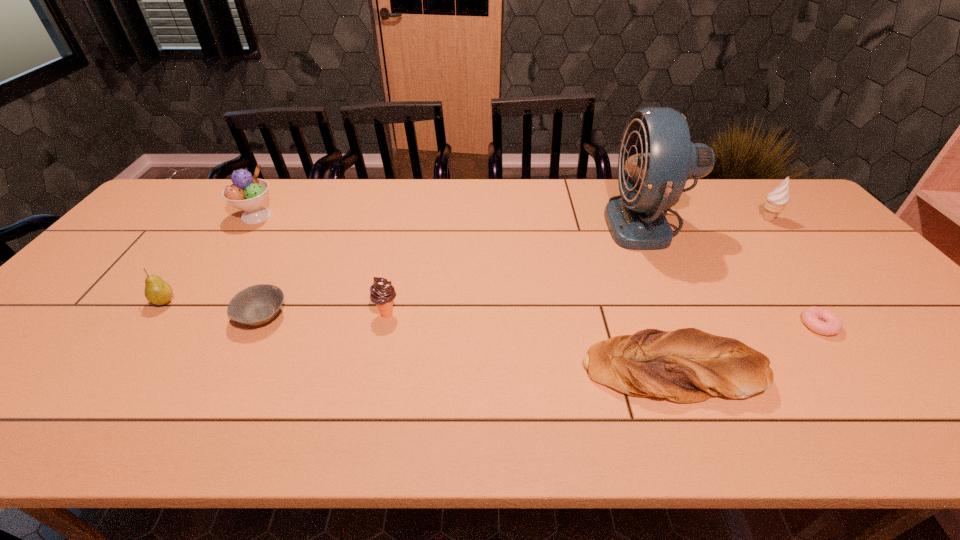
The image size is (960, 540). In order to click on vacant space located on the back of the bread in this screenshot , I will do pyautogui.click(x=646, y=306).

Where is `vacant space positioned 0.400m on the back of the bowl`? This screenshot has width=960, height=540. vacant space positioned 0.400m on the back of the bowl is located at coordinates (314, 212).

Where is `free spot located on the back of the doughnut`? The height and width of the screenshot is (540, 960). free spot located on the back of the doughnut is located at coordinates (794, 293).

Locate an element on the screen. The width and height of the screenshot is (960, 540). fan located at the far edge is located at coordinates (656, 157).

At what (x,y) coordinates should I click in order to perform the action: click on object present at the near edge. Please return your answer as a coordinate pair (x, y). The height and width of the screenshot is (540, 960). Looking at the image, I should click on (687, 365).

The width and height of the screenshot is (960, 540). What are the coordinates of `object that is at the right edge` in the screenshot? It's located at (777, 200).

Identify the location of object that is positioned at the far right corner. The image size is (960, 540). point(777,200).

Locate an element on the screen. The width and height of the screenshot is (960, 540). vacant region at the far edge of the desktop is located at coordinates (708, 199).

The height and width of the screenshot is (540, 960). I want to click on free space at the near edge of the desktop, so click(x=153, y=435).

Identify the location of vacant space at the left edge. (174, 238).